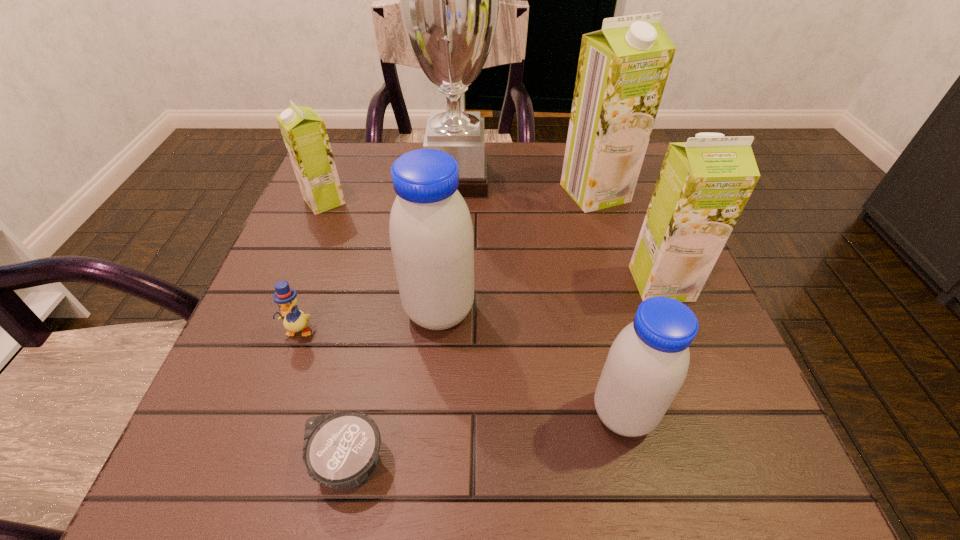
The image size is (960, 540). I want to click on vacant space at the near edge of the desktop, so click(378, 471).

Where is `vacant space at the left edge of the desktop`? This screenshot has height=540, width=960. vacant space at the left edge of the desktop is located at coordinates (272, 351).

The height and width of the screenshot is (540, 960). In order to click on free space at the right edge in this screenshot , I will do `click(646, 198)`.

The width and height of the screenshot is (960, 540). Identify the location of vacant space at the far left corner of the desktop. [x=379, y=157].

Find the location of `vacant space at the near right corner of the desktop`. vacant space at the near right corner of the desktop is located at coordinates (768, 489).

The width and height of the screenshot is (960, 540). I want to click on free spot between the nearest soya milk and the yellow duckling, so click(x=461, y=372).

Image resolution: width=960 pixels, height=540 pixels. What are the coordinates of `free space between the smallest green soya milk and the bigger blue soya milk` in the screenshot? It's located at (382, 256).

At what (x,y) coordinates should I click in order to perform the action: click on free space between the second tallest object and the second biggest green soya milk. Please return your answer as a coordinate pair (x, y). The image size is (960, 540). Looking at the image, I should click on click(x=628, y=238).

Identify the location of empty space between the smallest green soya milk and the trophy cup. (391, 191).

Where is `vacant space that is in between the shortest object and the leftmost green soya milk`? The height and width of the screenshot is (540, 960). vacant space that is in between the shortest object and the leftmost green soya milk is located at coordinates (336, 333).